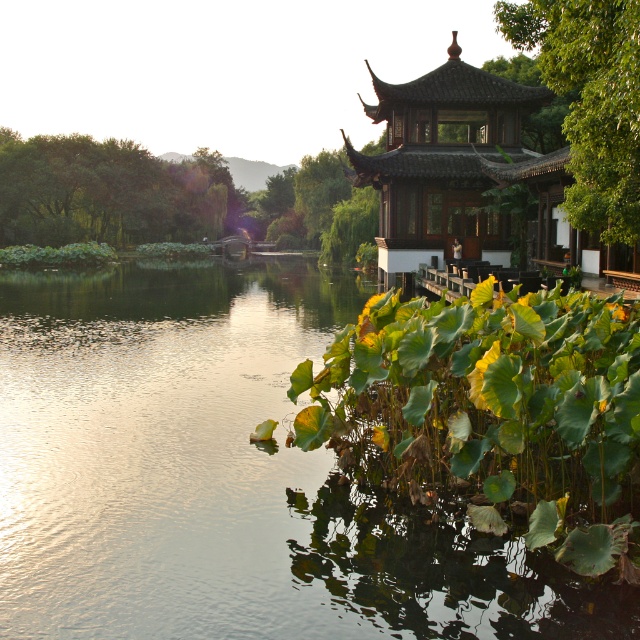
Describe the element at coordinates (150, 452) in the screenshot. I see `green reflective water at lower left` at that location.

Is green reflective water at lower left positioned in front of green leafy tree at upper right?

Yes, it is in front of green leafy tree at upper right.

Is point (211, 595) closer to camera compared to point (637, 147)?

Yes, point (211, 595) is in front of point (637, 147).

This screenshot has width=640, height=640. In order to click on green reflective water at lower left in this screenshot , I will do `click(150, 452)`.

The image size is (640, 640). Identify the location of wooden gazebo at center. (445, 163).

In the scene shown: Who is more distant from viewer, (474,88) or (579,180)?

Point (474,88)

Is point (484, 189) positioned behind point (611, 224)?

Yes, it is behind point (611, 224).

Where is `wooden gazebo at center`? wooden gazebo at center is located at coordinates (445, 163).

Does wooden gazebo at center appear on the left side of green leafy trees at left?

Incorrect, wooden gazebo at center is not on the left side of green leafy trees at left.

Identify the location of wooden gazebo at center. The height and width of the screenshot is (640, 640). (445, 163).

Where is `wooden gazebo at center`? The image size is (640, 640). wooden gazebo at center is located at coordinates (445, 163).